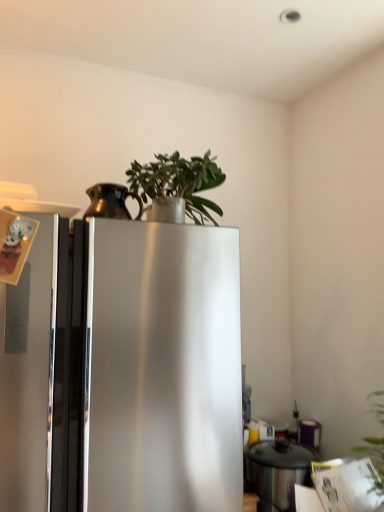
What do you see at coordinates (156, 367) in the screenshot? I see `satin silver refrigerator at center` at bounding box center [156, 367].

Measure the distance between satin silver refrigerator at center and camera.

A distance of 87.97 centimeters exists between satin silver refrigerator at center and camera.

Find the location of a particular element. stainless steel pot at lower right, the 1th appliance from the right is located at coordinates (276, 472).

Based on the photo, between green matte plant at upper center and stainless steel pot at lower right, the second appliance in the front-to-back sequence, which one has less height?

green matte plant at upper center is shorter.

Locate an element on the screen. houseplant above the stainless steel pot at lower right, the first appliance in the bottom-to-top sequence (from a real-world perspective) is located at coordinates pyautogui.click(x=179, y=182).

Does green matte plant at upper center contain stainless steel pot at lower right, the first appliance viewed from the back?

No.

What's the angular difference between green matte plant at upper center and stainless steel pot at lower right, the first appliance viewed from the back,'s facing directions?

1.9 degrees.

Does point (93, 199) come behind point (277, 504)?

No, it is not.

Is stainless steel pot at lower right, the second appliance in the front-to-back sequence, surrounded by bronze metallic pitcher at upper left, marked as the second appliance in a right-to-left arrangement?

No, bronze metallic pitcher at upper left, marked as the second appliance in a right-to-left arrangement, does not contain stainless steel pot at lower right, the second appliance in the front-to-back sequence.

Locate an element on the screen. This screenshot has height=512, width=384. appliance that is on the left side of stainless steel pot at lower right, the first appliance viewed from the back is located at coordinates (111, 201).

Can you tell me how much bronze metallic pitcher at upper left, the 1th appliance from the top, and green matte plant at upper center differ in facing direction?

1.16 degrees separate the facing orientations of bronze metallic pitcher at upper left, the 1th appliance from the top, and green matte plant at upper center.

Does point (84, 217) come closer to viewer compared to point (213, 206)?

Yes, point (84, 217) is closer to viewer.

From the picture: Can you confirm if bronze metallic pitcher at upper left, marked as the first appliance in a left-to-right arrangement, is wider than green matte plant at upper center?

No, bronze metallic pitcher at upper left, marked as the first appliance in a left-to-right arrangement, is not wider than green matte plant at upper center.

Locate an element on the screen. The height and width of the screenshot is (512, 384). houseplant in front of the bronze metallic pitcher at upper left, marked as the second appliance in a right-to-left arrangement is located at coordinates (179, 182).

In the scene shown: Is stainless steel pot at lower right, the first appliance viewed from the back, far from green matte plant at upper center?

No, there isn't a large distance between stainless steel pot at lower right, the first appliance viewed from the back, and green matte plant at upper center.

Which is in front, stainless steel pot at lower right, the first appliance in the bottom-to-top sequence, or green matte plant at upper center?

green matte plant at upper center.

Which of these two, stainless steel pot at lower right, the 2th appliance from the left, or green matte plant at upper center, stands taller?

stainless steel pot at lower right, the 2th appliance from the left, is taller.

Which is farther, (267,456) or (182,176)?

The point (267,456) is farther from the camera.

You are a GUI agent. You are given a task and a screenshot of the screen. Output one action in this format:
    pyautogui.click(x=<x>, y=<y>)
    Task: Click on the houseplant above the bronze metallic pitcher at upper left, marked as the first appliance in a left-to-right arrangement (from the image's perspective)
    The height and width of the screenshot is (512, 384).
    Given the screenshot: What is the action you would take?
    pyautogui.click(x=179, y=182)

Is green matte plant at upper center spatially inside bronze metallic pitcher at upper left, marked as the first appliance in a left-to-right arrangement, or outside of it?

green matte plant at upper center is located beyond the bounds of bronze metallic pitcher at upper left, marked as the first appliance in a left-to-right arrangement.

Considering the positions of objects green matte plant at upper center and bronze metallic pitcher at upper left, the second appliance in the back-to-front sequence, in the image provided, who is more to the right, green matte plant at upper center or bronze metallic pitcher at upper left, the second appliance in the back-to-front sequence,?

Positioned to the right is green matte plant at upper center.

Is green matte plant at upper center facing towards bronze metallic pitcher at upper left, acting as the second appliance starting from the bottom?

No, green matte plant at upper center is not oriented towards bronze metallic pitcher at upper left, acting as the second appliance starting from the bottom.

From the picture: Measure the distance from satin silver refrigerator at center to green matte plant at upper center.

satin silver refrigerator at center and green matte plant at upper center are 16.21 inches apart from each other.

Which point is more forward, (76,296) or (189,202)?

The point (76,296) is closer to the camera.

There is a satin silver refrigerator at center. At what (x,y) coordinates should I click in order to perform the action: click on houseplant above it (from a real-world perspective). Please return your answer as a coordinate pair (x, y). The image size is (384, 512). Looking at the image, I should click on (179, 182).

Is satin silver refrigerator at center surrounding green matte plant at upper center?

No, green matte plant at upper center is not surrounded by satin silver refrigerator at center.

Considering the positions of point (132, 198) and point (232, 361), is point (132, 198) closer or farther from the camera than point (232, 361)?

Point (132, 198) is positioned farther from the camera compared to point (232, 361).

Considering the relative positions of bronze metallic pitcher at upper left, marked as the second appliance in a right-to-left arrangement, and satin silver refrigerator at center in the image provided, is bronze metallic pitcher at upper left, marked as the second appliance in a right-to-left arrangement, to the left of satin silver refrigerator at center from the viewer's perspective?

Incorrect, bronze metallic pitcher at upper left, marked as the second appliance in a right-to-left arrangement, is not on the left side of satin silver refrigerator at center.

Where is `appliance above the satin silver refrigerator at center (from the image's perspective)`? appliance above the satin silver refrigerator at center (from the image's perspective) is located at coordinates (111, 201).

Does bronze metallic pitcher at upper left, marked as the second appliance in a right-to-left arrangement, have a greater height compared to satin silver refrigerator at center?

No, bronze metallic pitcher at upper left, marked as the second appliance in a right-to-left arrangement, is not taller than satin silver refrigerator at center.

Locate an element on the screen. houseplant in front of the stainless steel pot at lower right, the 2th appliance from the left is located at coordinates (179, 182).

The image size is (384, 512). I want to click on appliance above the stainless steel pot at lower right, the 2th appliance from the left (from the image's perspective), so click(111, 201).

Based on their spatial positions, is bronze metallic pitcher at upper left, the 1th appliance from the top, or green matte plant at upper center further from satin silver refrigerator at center?

Based on the image, green matte plant at upper center appears to be further to satin silver refrigerator at center.

Considering their positions, is satin silver refrigerator at center positioned further to green matte plant at upper center than stainless steel pot at lower right, positioned as the second appliance in top-to-bottom order?

stainless steel pot at lower right, positioned as the second appliance in top-to-bottom order, is further to green matte plant at upper center.

Looking at the image, which one is located further to satin silver refrigerator at center, stainless steel pot at lower right, the 2th appliance from the left, or bronze metallic pitcher at upper left, marked as the first appliance in a left-to-right arrangement?

Among the two, stainless steel pot at lower right, the 2th appliance from the left, is located further to satin silver refrigerator at center.

Based on the photo, considering their positions, is green matte plant at upper center positioned further to bronze metallic pitcher at upper left, marked as the second appliance in a right-to-left arrangement, than stainless steel pot at lower right, positioned as the second appliance in top-to-bottom order?

stainless steel pot at lower right, positioned as the second appliance in top-to-bottom order.

Looking at the image, which one is located closer to satin silver refrigerator at center, stainless steel pot at lower right, the 2th appliance from the left, or green matte plant at upper center?

Among the two, green matte plant at upper center is located nearer to satin silver refrigerator at center.

Looking at the image, which one is located further to stainless steel pot at lower right, the 1th appliance from the right, bronze metallic pitcher at upper left, the 1th appliance in the front-to-back sequence, or green matte plant at upper center?

Among the two, bronze metallic pitcher at upper left, the 1th appliance in the front-to-back sequence, is located further to stainless steel pot at lower right, the 1th appliance from the right.

In the scene shown: Based on their spatial positions, is satin silver refrigerator at center or stainless steel pot at lower right, the second appliance in the front-to-back sequence, further from bronze metallic pitcher at upper left, the second appliance in the back-to-front sequence?

Based on the image, stainless steel pot at lower right, the second appliance in the front-to-back sequence, appears to be further to bronze metallic pitcher at upper left, the second appliance in the back-to-front sequence.

Based on the photo, considering their positions, is green matte plant at upper center positioned closer to satin silver refrigerator at center than stainless steel pot at lower right, the first appliance viewed from the back?

green matte plant at upper center is closer to satin silver refrigerator at center.

Locate an element on the screen. This screenshot has width=384, height=512. refrigerator between bronze metallic pitcher at upper left, marked as the first appliance in a left-to-right arrangement, and stainless steel pot at lower right, the first appliance viewed from the back, from top to bottom is located at coordinates (156, 367).

Where is `appliance between green matte plant at upper center and stainless steel pot at lower right, the first appliance viewed from the back, in the vertical direction`? appliance between green matte plant at upper center and stainless steel pot at lower right, the first appliance viewed from the back, in the vertical direction is located at coordinates (111, 201).

Where is `refrigerator that lies between green matte plant at upper center and stainless steel pot at lower right, the 2th appliance from the left, from top to bottom`? This screenshot has width=384, height=512. refrigerator that lies between green matte plant at upper center and stainless steel pot at lower right, the 2th appliance from the left, from top to bottom is located at coordinates (156, 367).

The height and width of the screenshot is (512, 384). Identify the location of appliance between green matte plant at upper center and satin silver refrigerator at center in the up-down direction. (111, 201).